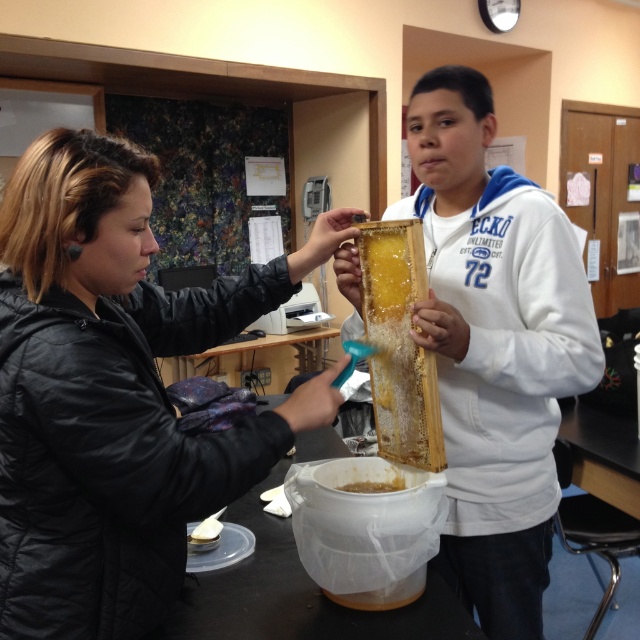
Question: Which point is farther to the camera?

Choices:
 (A) yellow translucent honeycomb at center
 (B) translucent honeycomb at center

Answer: (A)

Question: Does black matte jacket at left have a smaller size compared to translucent honeycomb at center?

Choices:
 (A) no
 (B) yes

Answer: (A)

Question: Is the position of black matte jacket at left less distant than that of yellow translucent honeycomb at center?

Choices:
 (A) yes
 (B) no

Answer: (A)

Question: Which of the following is the closest to the observer?

Choices:
 (A) white cotton hoodie at center
 (B) translucent honeycomb at center
 (C) black matte jacket at left

Answer: (C)

Question: Does white cotton hoodie at center lie behind yellow translucent honeycomb at center?

Choices:
 (A) yes
 (B) no

Answer: (B)

Question: Based on their relative distances, which object is farther from the black matte jacket at left?

Choices:
 (A) yellow translucent honeycomb at center
 (B) translucent honeycomb at center
 (C) white cotton hoodie at center

Answer: (A)